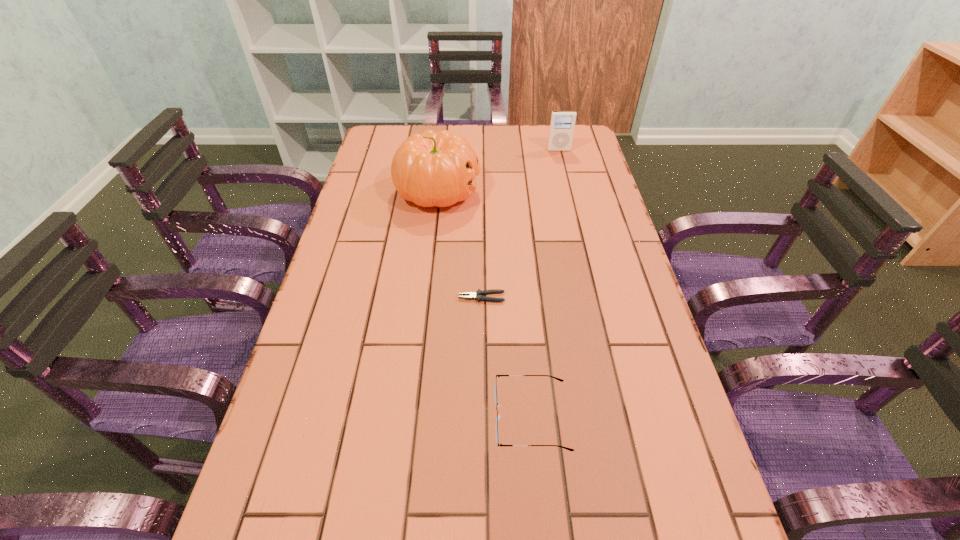
Where is `vacant space at the far edge`? This screenshot has width=960, height=540. vacant space at the far edge is located at coordinates (479, 151).

In the image, there is a desktop. Where is `free space at the left edge`? The width and height of the screenshot is (960, 540). free space at the left edge is located at coordinates (304, 387).

Where is `vacant space at the right edge of the desktop`? The height and width of the screenshot is (540, 960). vacant space at the right edge of the desktop is located at coordinates (564, 199).

Identify the location of vacant space at the far right corner. (569, 158).

Where is `free area in between the farthest object and the second farthest object`? This screenshot has width=960, height=540. free area in between the farthest object and the second farthest object is located at coordinates pyautogui.click(x=498, y=171).

Where is `unoccupied area between the tallest object and the shortest object`? unoccupied area between the tallest object and the shortest object is located at coordinates (460, 244).

At what (x,y) coordinates should I click in order to perform the action: click on vacant area that lies between the spectacles and the shortest object. Please return your answer as a coordinate pair (x, y). Looking at the image, I should click on (507, 357).

Image resolution: width=960 pixels, height=540 pixels. I want to click on vacant space that is in between the iPod and the second nearest object, so click(520, 224).

Locate an element on the screen. This screenshot has height=540, width=960. free point between the farthest object and the shortest object is located at coordinates (520, 224).

At what (x,y) coordinates should I click in order to perform the action: click on vacant space that is in between the pliers and the rightmost object. Please return your answer as a coordinate pair (x, y). Looking at the image, I should click on (520, 224).